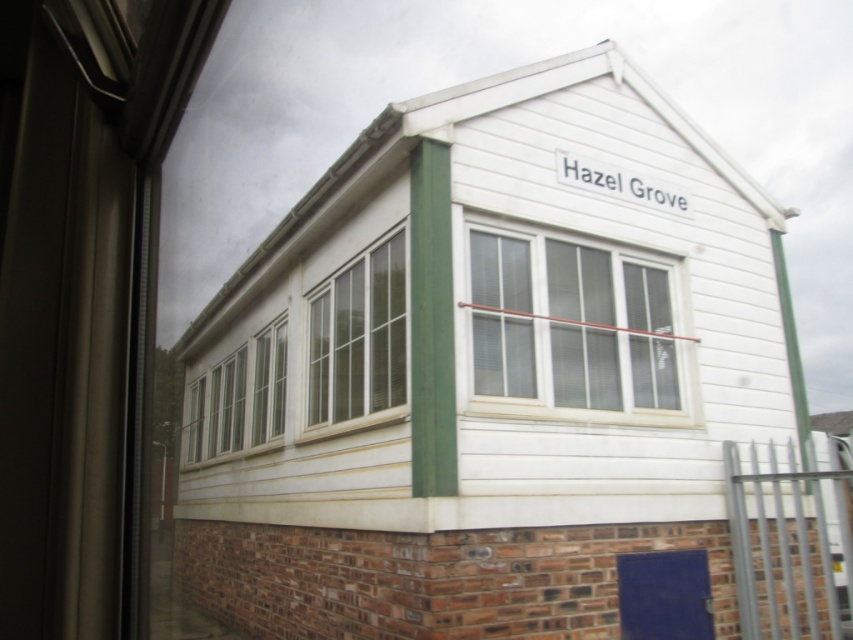
This screenshot has width=853, height=640. Describe the element at coordinates (573, 330) in the screenshot. I see `white plastic window at center` at that location.

Does white plastic window at center appear on the left side of white glass window at center?

No, white plastic window at center is not to the left of white glass window at center.

Does point (585, 266) come farther from viewer compared to point (213, 394)?

That is False.

This screenshot has width=853, height=640. In order to click on white plastic window at center in this screenshot , I will do `click(573, 330)`.

Which is more to the left, white plastic window at center or white wood window at center?

white wood window at center is more to the left.

Can you confirm if white plastic window at center is taller than white wood window at center?

No, white plastic window at center is not taller than white wood window at center.

Between point (669, 339) and point (341, 308), which one is positioned behind?

The point (341, 308) is more distant.

Where is `white plastic window at center`? white plastic window at center is located at coordinates (573, 330).

Is white wood window at center wider than white glass window at center?

No, white wood window at center is not wider than white glass window at center.

Which is behind, point (352, 349) or point (231, 403)?

Point (231, 403)

This screenshot has width=853, height=640. Find the location of `white wood window at center`. white wood window at center is located at coordinates (x=358, y=337).